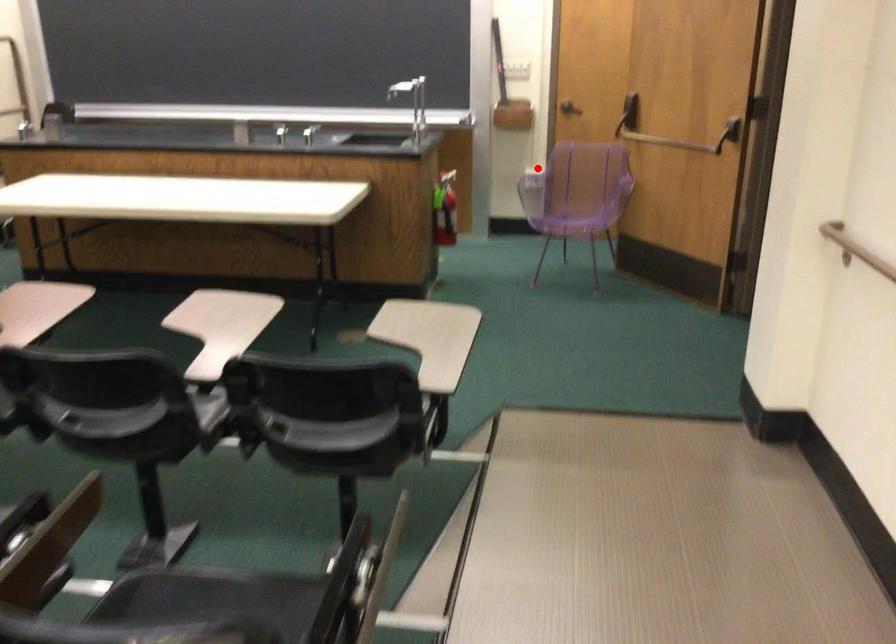
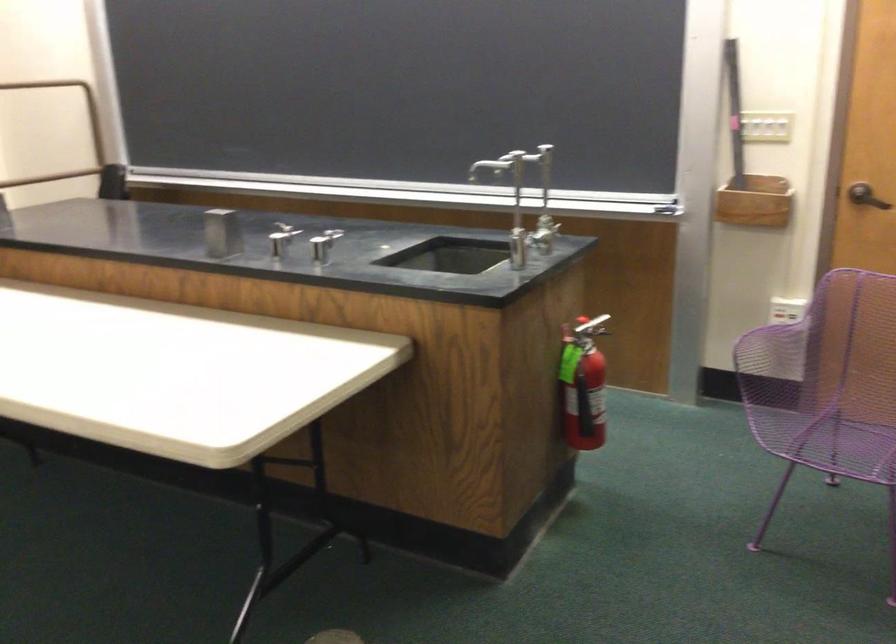
Find the pixel in the second image that matches the highlighted location in the first image.

(787, 310)